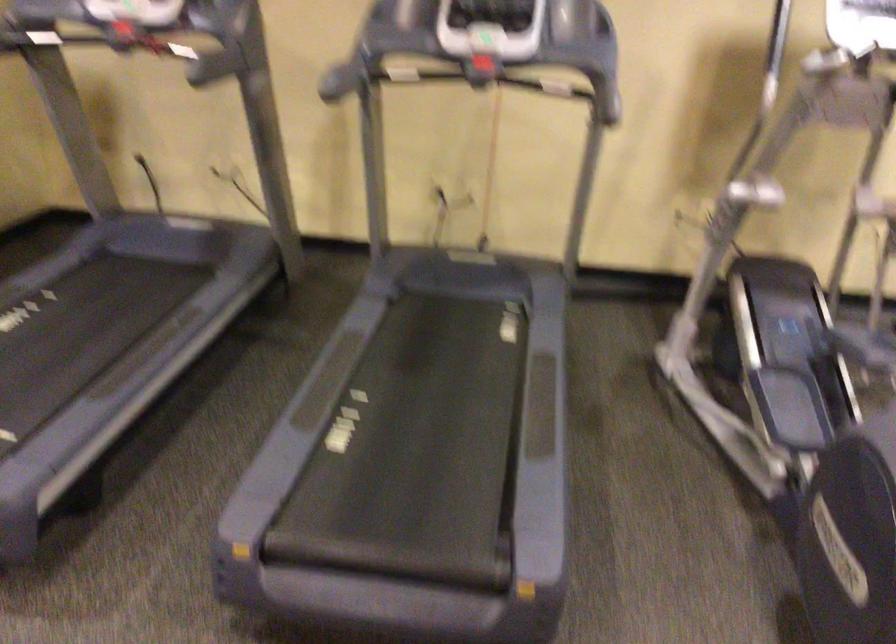
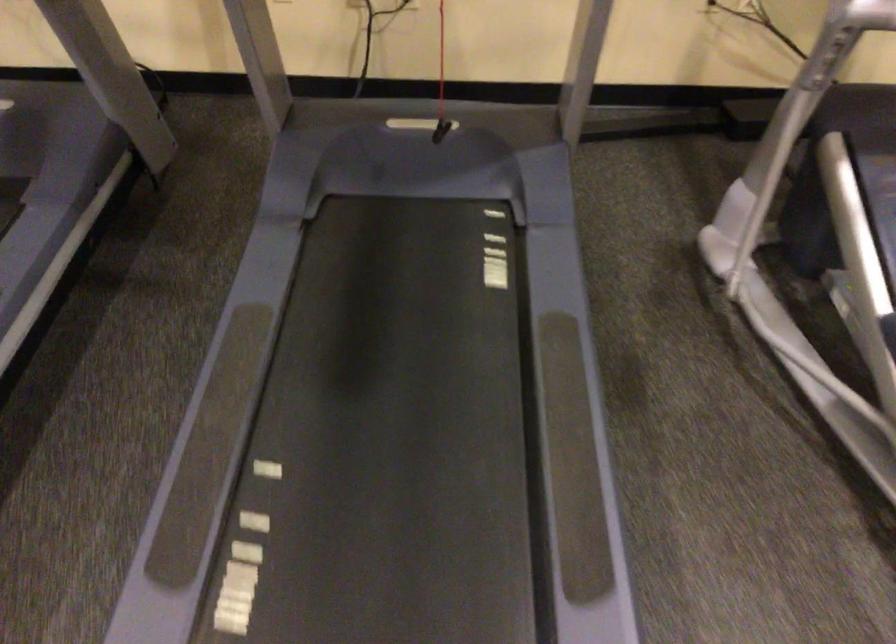
Where in the second image is the point corresponding to point (677, 350) from the first image?

(721, 240)